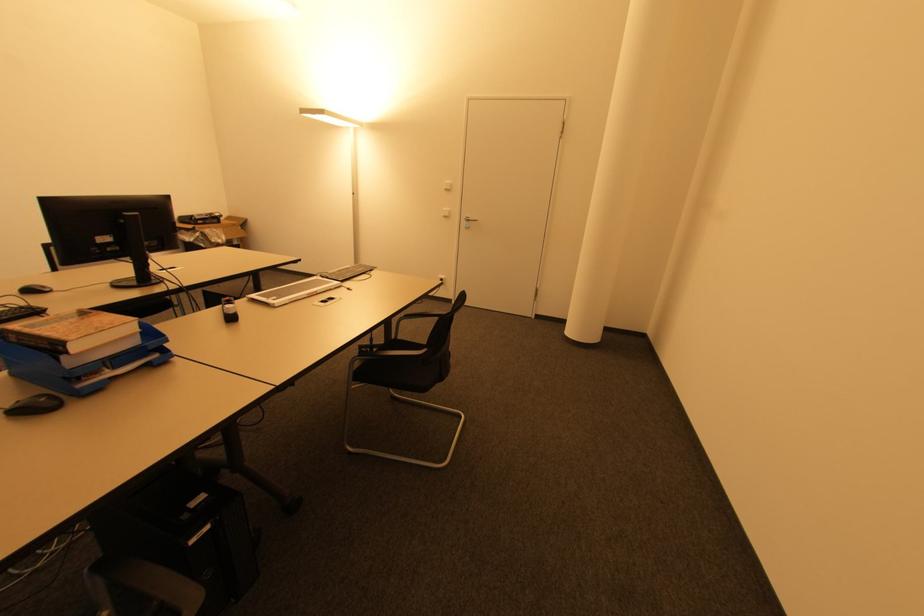
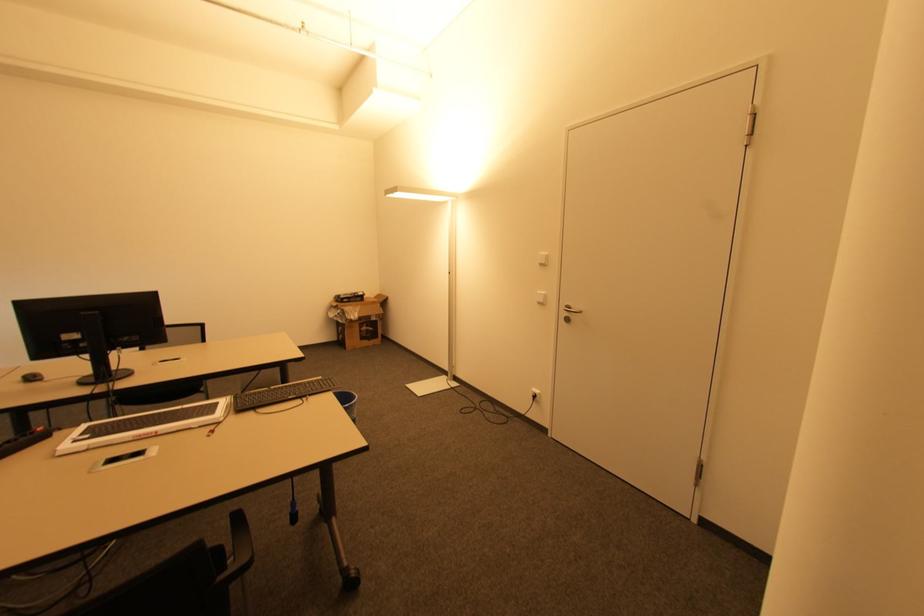
The point at (446, 217) is marked in the first image. Where is the corresponding point in the second image?

(541, 302)